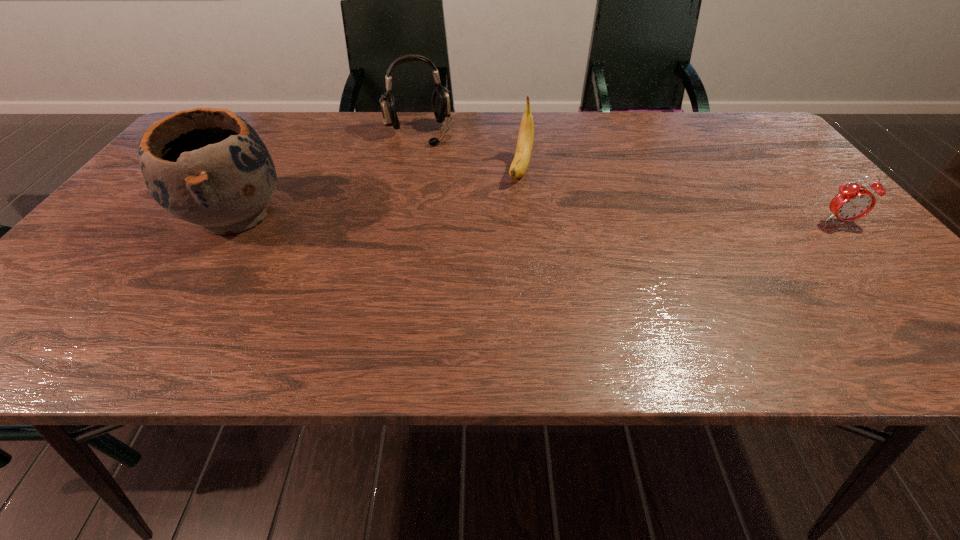
This screenshot has width=960, height=540. Find the location of `vacant space at the near edge of the desktop`. vacant space at the near edge of the desktop is located at coordinates (402, 285).

Where is `vacant space at the left edge of the desktop`? The width and height of the screenshot is (960, 540). vacant space at the left edge of the desktop is located at coordinates (176, 220).

You are a GUI agent. You are given a task and a screenshot of the screen. Output one action in this format:
    pyautogui.click(x=<x>, y=<y>)
    Task: Click on the vacant area at the right edge of the desktop
    The height and width of the screenshot is (540, 960).
    Given the screenshot: What is the action you would take?
    pyautogui.click(x=811, y=240)

Identify the location of free spot at the near left corner of the desktop. The width and height of the screenshot is (960, 540). (63, 306).

Where is `free space at the near right corner`? The height and width of the screenshot is (540, 960). free space at the near right corner is located at coordinates (843, 301).

Locate an element on the screen. This screenshot has width=960, height=540. vacant area between the headset and the pottery is located at coordinates (325, 174).

Locate an element on the screen. vacant area between the leftmost object and the farthest object is located at coordinates (325, 174).

Identify the location of vacant space that's between the third object from right to left and the rightmost object. (629, 177).

Identify the location of free point between the leftmost object and the third object from right to left. (325, 174).

Where is `free spot between the shortest object and the second shortest object`? free spot between the shortest object and the second shortest object is located at coordinates 681,195.